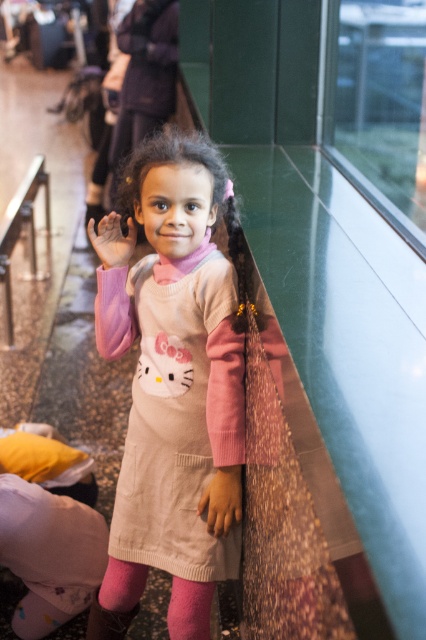
You are a fashion designer observing the young girl in the scene. You need to determine which item is taller between the pink cotton dress at center and the pink fuzzy sock at lower center. Which one is taller?

The pink cotton dress at center is taller than the pink fuzzy sock at lower center according to the description.

You are a robot with a 10 inch long arm. You need to touch the pink fuzzy sock at lower center with your hand. The smooth beige hand at center is in your way. Can your arm reach the sock without moving the hand?

The pink fuzzy sock at lower center and smooth beige hand at center are 10.18 inches apart. Since your arm is 10 inches long, it is slightly shorter than the distance, so you cannot reach the sock without moving the hand.

You are standing in the shopping mall and see a young girl wearing a Hello Kitty dress. There is a point marked at coordinates (172, 371). What object is located at that point?

The pink cotton dress at center is located at point (172, 371).